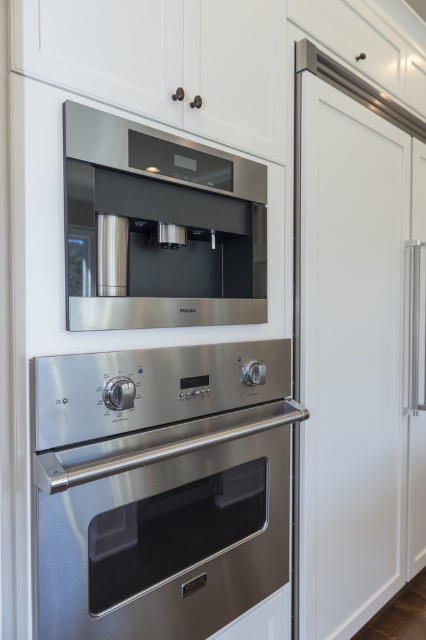
You are a kitchen designer and need to ensure that the distance between the stainless steel coffee machine at upper center and the oven below it is at least 36 inches for proper ventilation. Is this requirement met?

The distance between the stainless steel coffee machine at upper center and the oven below it is exactly 36.01 inches, which meets the requirement of at least 36 inches for proper ventilation.

You are standing in the kitchen and want to reach the point at coordinates point (146,497). If your arm can extend 3 feet, can you reach it?

The point (146,497) is 3.41 feet away from you, which is beyond the 3 feet reach of your arm. Therefore, you cannot reach it.